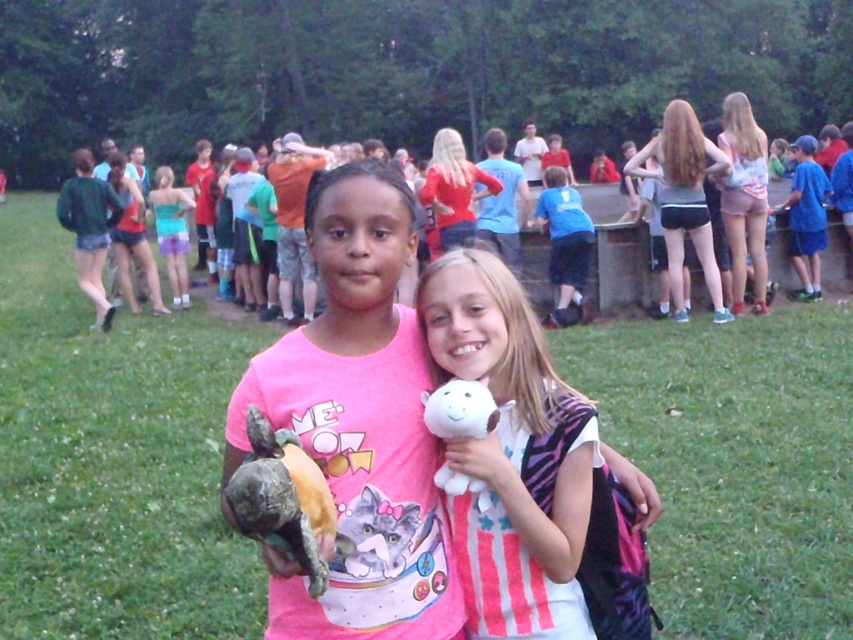
Is light brown shorts at right closer to camera compared to blue cotton shirt at right?

Yes, it is in front of blue cotton shirt at right.

Which is below, light brown shorts at right or blue cotton shirt at right?

light brown shorts at right

Locate an element on the screen. light brown shorts at right is located at coordinates (744, 198).

Who is more distant from viewer, (558, 540) or (706, 205)?

The point (706, 205) is behind.

Which is more to the right, white plush toy at center or matte black shorts at right?

From the viewer's perspective, matte black shorts at right appears more on the right side.

At what (x,y) coordinates should I click in order to perform the action: click on white plush toy at center. Please return your answer as a coordinate pair (x, y). This screenshot has width=853, height=640. Looking at the image, I should click on (508, 456).

In order to click on white plush toy at center in this screenshot , I will do `click(508, 456)`.

Can you confirm if white plush toy at center is positioned below blue cotton shirt at center?

Correct, white plush toy at center is located below blue cotton shirt at center.

Which is below, white plush toy at center or blue cotton shirt at center?

white plush toy at center is below.

Does point (496, 560) come farther from viewer compared to point (572, 317)?

No.

This screenshot has height=640, width=853. In order to click on white plush toy at center in this screenshot , I will do `click(508, 456)`.